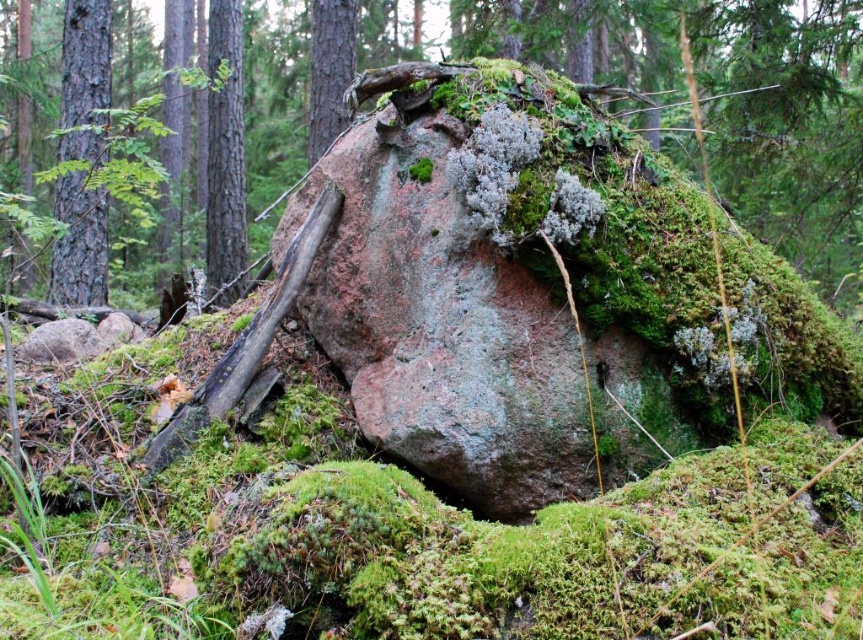
Is point (230, 301) behind point (315, 115)?

No, (230, 301) is closer to viewer.

Who is lower down, brown wood tree at center or green mossy tree trunk at upper center?

Positioned lower is brown wood tree at center.

Is point (234, 138) more distant than point (347, 38)?

Yes, it is behind point (347, 38).

This screenshot has height=640, width=863. I want to click on brown wood tree at center, so click(225, 152).

Can you confirm if green mossy rock at center is bigger than green mossy tree trunk at upper center?

Indeed, green mossy rock at center has a larger size compared to green mossy tree trunk at upper center.

Does green mossy rock at center appear on the left side of green mossy tree trunk at upper center?

Incorrect, green mossy rock at center is not on the left side of green mossy tree trunk at upper center.

Is point (294, 145) closer to viewer compared to point (345, 51)?

No, (294, 145) is further to viewer.

I want to click on green mossy rock at center, so click(x=788, y=125).

Between green mossy rock at center and brown wood tree at center, which one has less height?

brown wood tree at center is shorter.

Can you confirm if green mossy rock at center is positioned below brown wood tree at center?

Actually, green mossy rock at center is above brown wood tree at center.

Describe the element at coordinates (788, 125) in the screenshot. I see `green mossy rock at center` at that location.

Where is `green mossy rock at center`? This screenshot has height=640, width=863. green mossy rock at center is located at coordinates (788, 125).